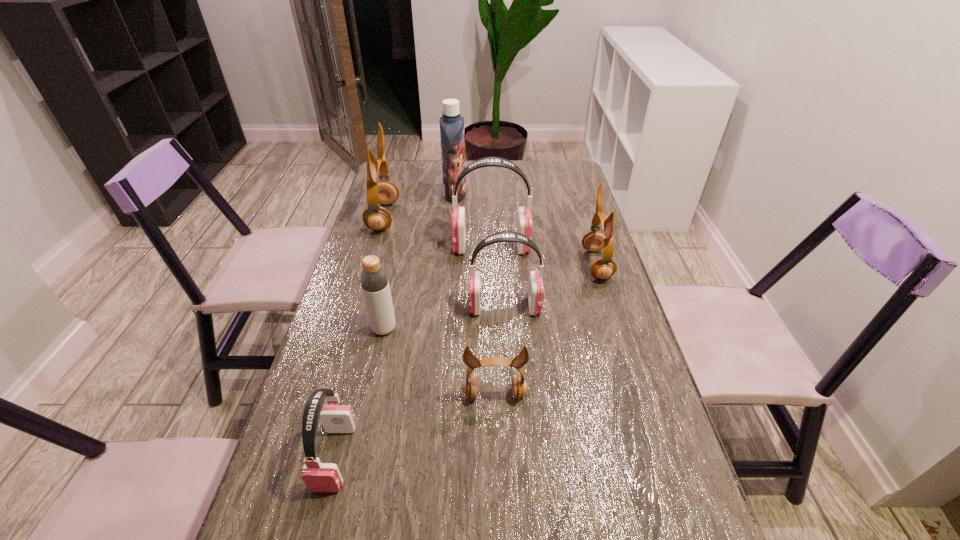
Where is `vacant point located 0.100m on the front-facing side of the rightmost brown earphone`? vacant point located 0.100m on the front-facing side of the rightmost brown earphone is located at coordinates (551, 265).

The image size is (960, 540). Find the location of `free space located 0.110m on the front-facing side of the rightmost brown earphone`. free space located 0.110m on the front-facing side of the rightmost brown earphone is located at coordinates (548, 265).

Where is `blank area located 0.230m on the outer surface of the third nearest earphone`? This screenshot has height=540, width=960. blank area located 0.230m on the outer surface of the third nearest earphone is located at coordinates (385, 307).

Locate an element on the screen. free location located 0.080m on the outer surface of the third nearest earphone is located at coordinates (440, 307).

Image resolution: width=960 pixels, height=540 pixels. I want to click on free location located on the outer surface of the third nearest earphone, so click(415, 307).

Locate an element on the screen. The width and height of the screenshot is (960, 540). blank area located 0.080m on the right of the sixth farthest object is located at coordinates (427, 329).

Where is `free region located 0.120m on the front-facing side of the fifth farthest earphone`? free region located 0.120m on the front-facing side of the fifth farthest earphone is located at coordinates (496, 458).

The height and width of the screenshot is (540, 960). I want to click on object that is at the far edge, so click(x=451, y=123).

At what (x,y) coordinates should I click in order to perform the action: click on bottle that is positioned at the left edge. Please return your answer as a coordinate pair (x, y). Image resolution: width=960 pixels, height=540 pixels. Looking at the image, I should click on (374, 281).

Find the location of a particular element. The height and width of the screenshot is (540, 960). object that is at the right edge is located at coordinates (595, 240).